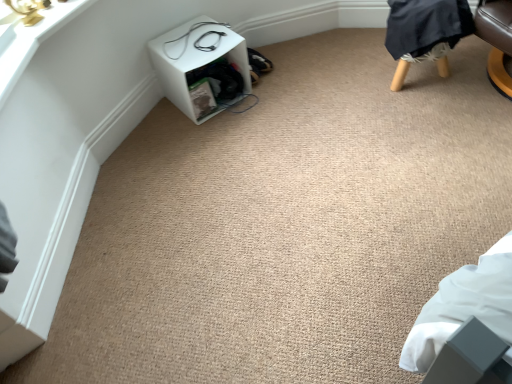
Describe the element at coordinates (202, 67) in the screenshot. I see `white plastic cube at upper left` at that location.

I want to click on white plastic cube at upper left, so click(x=202, y=67).

Image resolution: width=512 pixels, height=384 pixels. In order to click on white plastic cube at upper left in this screenshot , I will do `click(202, 67)`.